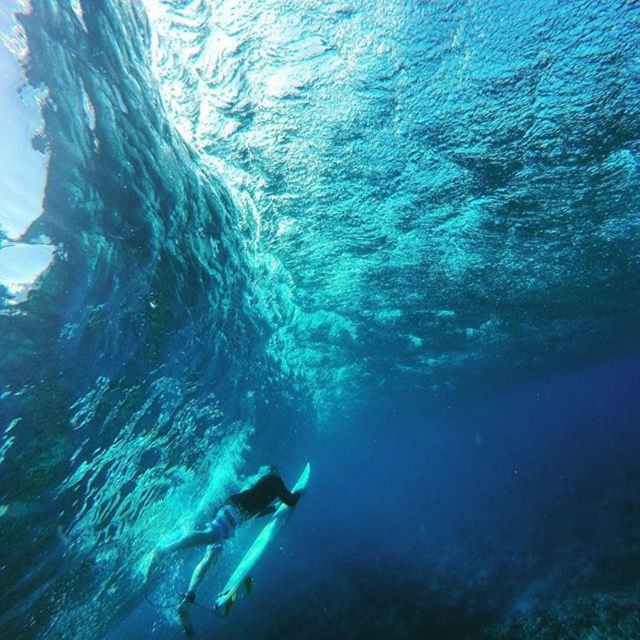
Is smooth skin diver at lower center smaller than white glossy surfboard at lower center?

Yes.

The image size is (640, 640). What do you see at coordinates (230, 534) in the screenshot? I see `smooth skin diver at lower center` at bounding box center [230, 534].

Where is `smooth skin diver at lower center`? This screenshot has width=640, height=640. smooth skin diver at lower center is located at coordinates (230, 534).